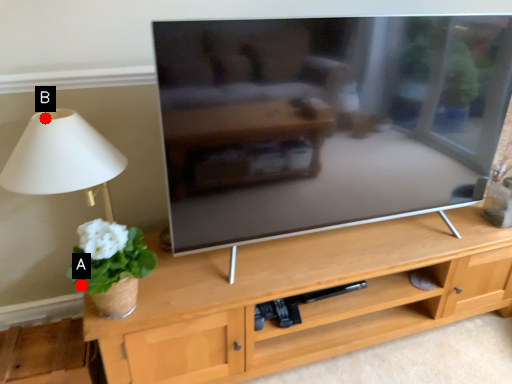
Question: Two points are circled on the image, labeled by A and B beside each circle. Among these points, which one is farthest from the camera?

Choices:
 (A) A is further
 (B) B is further

Answer: (B)